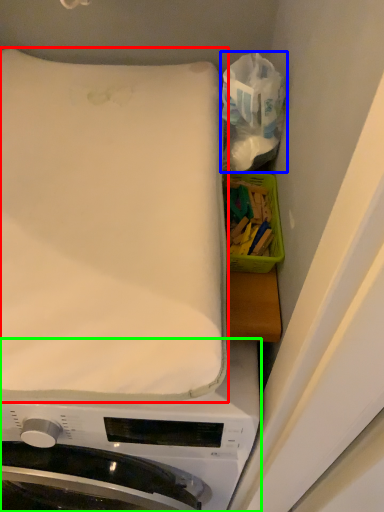
Question: Considering the real-world distances, which object is closest to mattress (highlighted by a red box)? tissue (highlighted by a blue box) or washing machine (highlighted by a green box).

Choices:
 (A) tissue
 (B) washing machine

Answer: (A)